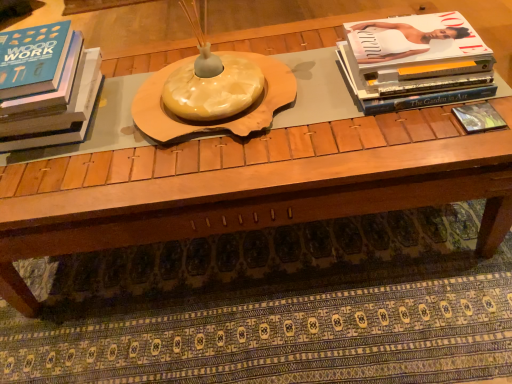
Image resolution: width=512 pixels, height=384 pixels. What are the coordinates of `vacant area that lies in front of matte white book at upper right, the second book positioned from the left` in the screenshot? It's located at (414, 139).